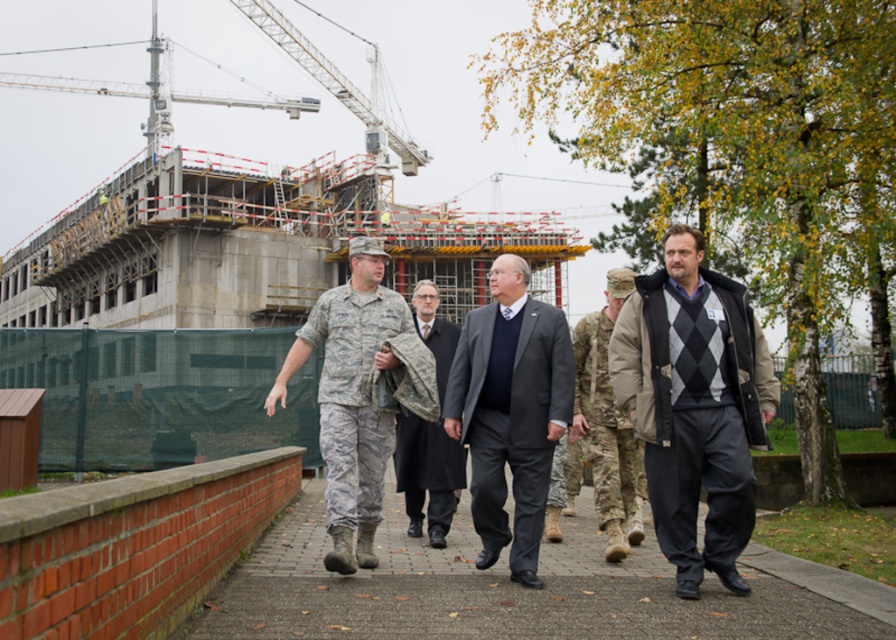
You are a photographer standing at the end of the pathway. You want to take a photo of the dark gray suit at center and camouflage fabric jacket at left. Can you fit both subjects in the frame if your camera has a 30 inch field of view?

The dark gray suit at center and camouflage fabric jacket at left are 28.92 inches apart, so yes, both subjects can fit within the camera frame since the distance between them is less than the 30 inch field of view.